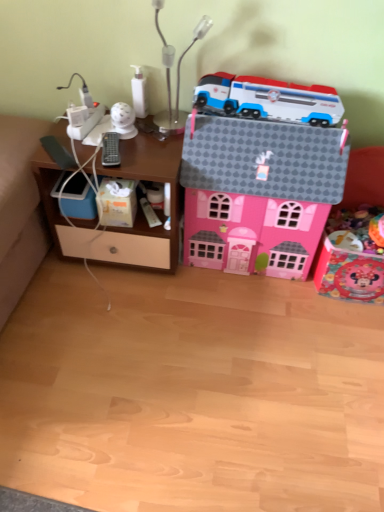
Identify the location of free point to the right of white glossy security camera at upper center, which is counted as the first toy, starting from the left. (157, 136).